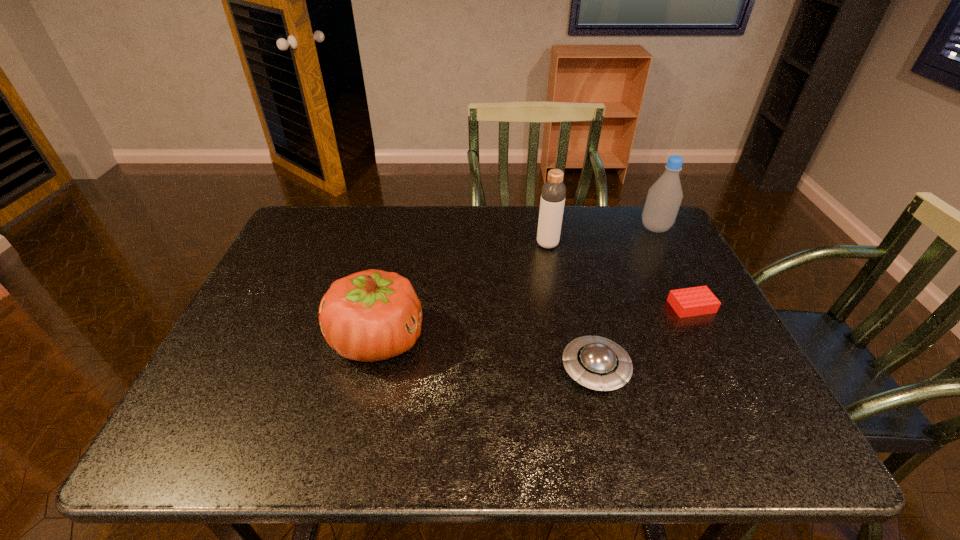
Where is `free spot located 0.290m on the side of the leftmost object with the cute face`? free spot located 0.290m on the side of the leftmost object with the cute face is located at coordinates (547, 339).

Identify the location of vacant space located 0.230m on the back of the fourth tallest object. The width and height of the screenshot is (960, 540). (573, 278).

Where is `vacant space located 0.110m on the back of the shortest object`? The image size is (960, 540). vacant space located 0.110m on the back of the shortest object is located at coordinates (672, 268).

I want to click on bottle present at the right edge, so click(664, 197).

I want to click on Lego that is at the right edge, so click(694, 301).

At what (x,y) coordinates should I click in order to perform the action: click on object that is at the far right corner. Please return your answer as a coordinate pair (x, y). The height and width of the screenshot is (540, 960). Looking at the image, I should click on (664, 197).

In the image, there is a desktop. Where is `free space at the far edge`? Image resolution: width=960 pixels, height=540 pixels. free space at the far edge is located at coordinates (481, 221).

In order to click on blank space at the near edge of the desktop in this screenshot , I will do `click(579, 415)`.

What are the coordinates of `vacant space at the left edge of the desktop` in the screenshot? It's located at (232, 380).

The width and height of the screenshot is (960, 540). What are the coordinates of `vacant area at the right edge` in the screenshot? It's located at (668, 353).